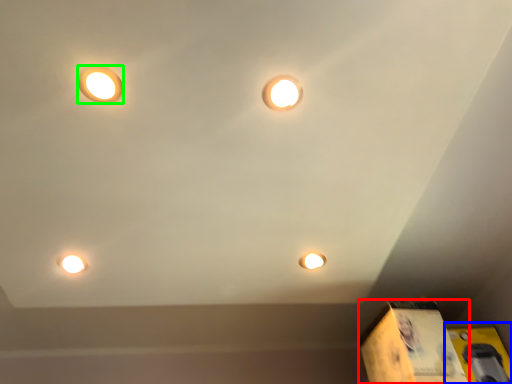
Question: Which object is positioned farthest from cardboard box (highlighted by a red box)? Select from cardboard box (highlighted by a blue box) and lamp (highlighted by a green box).

Choices:
 (A) cardboard box
 (B) lamp

Answer: (B)